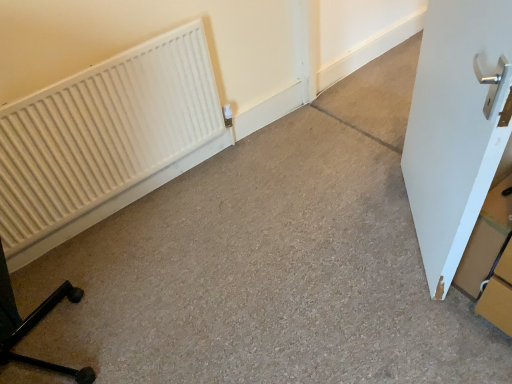
What do you see at coordinates (457, 127) in the screenshot? I see `white matte door at right` at bounding box center [457, 127].

Identify the location of white matte door at right. The width and height of the screenshot is (512, 384). coord(457,127).

In terms of height, does cardboard box at right look taller or shorter compared to white matte door at right?

Clearly, cardboard box at right is shorter compared to white matte door at right.

Would you say cardboard box at right is to the left or to the right of white matte door at right in the picture?

Based on their positions, cardboard box at right is located to the right of white matte door at right.

From a real-world perspective, is cardboard box at right positioned under white matte door at right based on gravity?

Correct, in the physical world, cardboard box at right is lower than white matte door at right.

Is white matte door at right located within cardboard box at right?

No, white matte door at right is located outside of cardboard box at right.

Does point (492, 43) lie behind point (60, 213)?

No, it is not.

Is white matte door at right oriented away from white matte radiator at left?

No, white matte door at right is not facing the opposite direction of white matte radiator at left.

Based on the photo, would you say white matte door at right contains white matte radiator at left?

No.

Find the location of a particular element. door that appears in front of the white matte radiator at left is located at coordinates (457, 127).

From the image's perspective, between white matte radiator at left and white matte door at right, who is located below?

white matte radiator at left appears lower in the image.

Is white matte radiator at left behind white matte door at right?

That is True.

Looking at this image, can you confirm if white matte radiator at left is positioned to the right of white matte door at right?

Incorrect, white matte radiator at left is not on the right side of white matte door at right.

From the image's perspective, does cardboard box at right appear lower than white matte radiator at left?

Yes, from the image's perspective, cardboard box at right is beneath white matte radiator at left.

How far apart are cardboard box at right and white matte radiator at left?

4.73 feet.

Considering the positions of objects cardboard box at right and white matte radiator at left in the image provided, who is more to the right, cardboard box at right or white matte radiator at left?

Positioned to the right is cardboard box at right.

Which of these two, cardboard box at right or white matte radiator at left, is bigger?

white matte radiator at left is bigger.

Can you confirm if white matte door at right is positioned to the left of cardboard box at right?

Yes, white matte door at right is to the left of cardboard box at right.

Identify the location of cardboard box behind the white matte door at right. The width and height of the screenshot is (512, 384). (486, 241).

How different are the orientations of white matte door at right and cardboard box at right in degrees?

There is a 44.3-degree angle between the facing directions of white matte door at right and cardboard box at right.

Which object is more forward, white matte door at right or cardboard box at right?

white matte door at right is in front.

From the image's perspective, is white matte radiator at left on top of cardboard box at right?

Indeed, from the image's perspective, white matte radiator at left is shown above cardboard box at right.

Is white matte radiator at left bigger or smaller than cardboard box at right?

white matte radiator at left is bigger than cardboard box at right.

Between white matte radiator at left and cardboard box at right, which one has larger width?

cardboard box at right is wider.

Is white matte radiator at left positioned before cardboard box at right?

No, white matte radiator at left is behind cardboard box at right.

Find the location of a particular element. door above the cardboard box at right (from the image's perspective) is located at coordinates (457, 127).

Identify the location of radiator below the white matte door at right (from the image's perspective). Image resolution: width=512 pixels, height=384 pixels. (105, 140).

Based on their spatial positions, is cardboard box at right or white matte radiator at left further from white matte door at right?

white matte radiator at left.

When comparing their distances from white matte radiator at left, does cardboard box at right or white matte door at right seem closer?

Among the two, white matte door at right is located nearer to white matte radiator at left.

Looking at the image, which one is located closer to cardboard box at right, white matte door at right or white matte radiator at left?

The object closer to cardboard box at right is white matte door at right.

Considering their positions, is white matte door at right positioned further to white matte radiator at left than cardboard box at right?

cardboard box at right is positioned further to the anchor white matte radiator at left.

When comparing their distances from cardboard box at right, does white matte radiator at left or white matte door at right seem further?

Among the two, white matte radiator at left is located further to cardboard box at right.

From the image, which object appears to be nearer to white matte door at right, white matte radiator at left or cardboard box at right?

cardboard box at right is closer to white matte door at right.

I want to click on door between white matte radiator at left and cardboard box at right, so click(x=457, y=127).